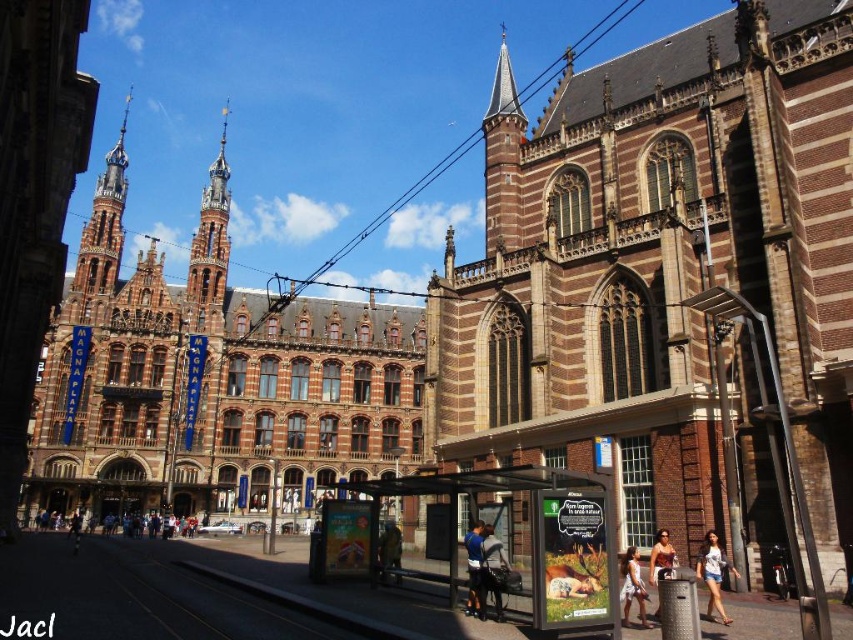
Is point (717, 593) positioned before point (71, 522)?

Yes, point (717, 593) is in front of point (71, 522).

Is point (723, 621) more distant than point (132, 529)?

No, it is in front of (132, 529).

Where is `white cotton shirt at lower right`? The width and height of the screenshot is (853, 640). white cotton shirt at lower right is located at coordinates pos(712,576).

Between transparent plastic bus stop at center and white cotton shirt at lower right, which one has less height?

With less height is white cotton shirt at lower right.

This screenshot has height=640, width=853. In order to click on transparent plastic bus stop at center in this screenshot , I will do `click(479, 490)`.

Identify the location of transparent plastic bus stop at center. Image resolution: width=853 pixels, height=640 pixels. (479, 490).

Find the location of a particular element. The height and width of the screenshot is (640, 853). dark blue shirt at center is located at coordinates (492, 568).

Can you confirm if dark blue shirt at center is shorter than white cotton dress at lower right?

In fact, dark blue shirt at center may be taller than white cotton dress at lower right.

Where is `dark blue shirt at center`? dark blue shirt at center is located at coordinates (492, 568).